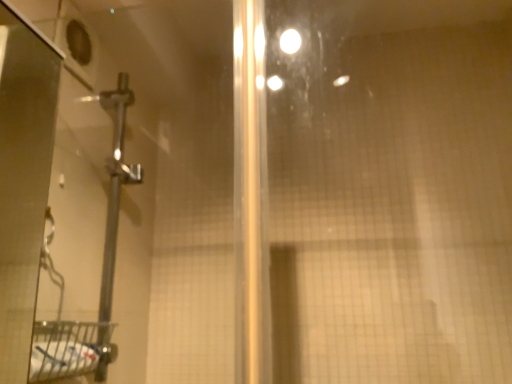
Measure the distance between point (93, 214) and camera.

They are 3.31 feet apart.

Describe the element at coordinates (151, 182) in the screenshot. I see `clear glass shower door at left` at that location.

The height and width of the screenshot is (384, 512). In order to click on clear glass shower door at left in this screenshot , I will do `click(151, 182)`.

Where is `clear glass shower door at left`? clear glass shower door at left is located at coordinates (151, 182).